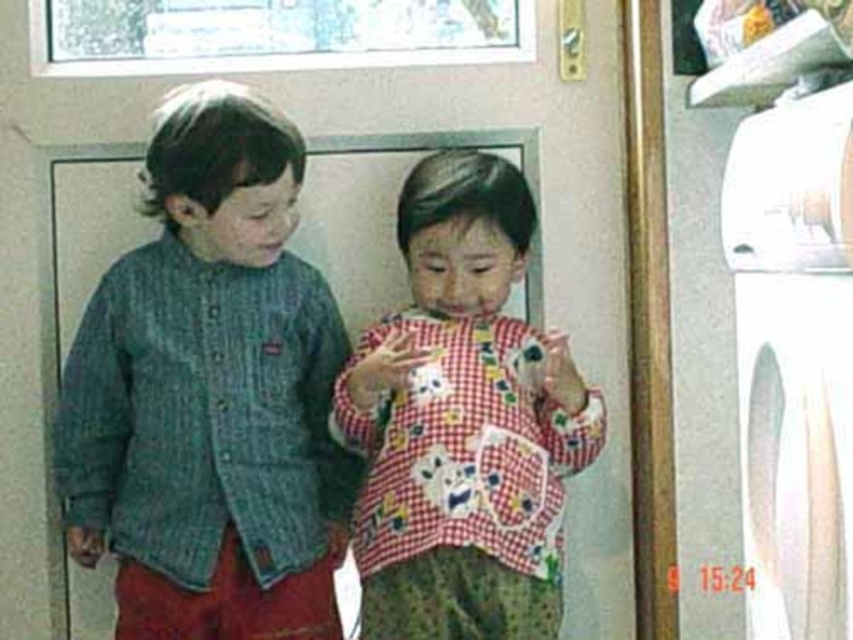
Question: Does red checkered shirt at center lie in front of white plastic washing machine at right?

Choices:
 (A) yes
 (B) no

Answer: (B)

Question: Which object appears closest to the camera in this image?

Choices:
 (A) white plastic washing machine at right
 (B) red checkered shirt at center
 (C) green textured sweater at left

Answer: (A)

Question: Which point is farther from the camera taking this photo?

Choices:
 (A) (750, 365)
 (B) (293, 272)

Answer: (B)

Question: Can you confirm if green textured sweater at left is positioned to the right of white plastic washing machine at right?

Choices:
 (A) yes
 (B) no

Answer: (B)

Question: Which object appears farthest from the camera in this image?

Choices:
 (A) red checkered shirt at center
 (B) green textured sweater at left

Answer: (A)

Question: Can you confirm if red checkered shirt at center is wider than white plastic washing machine at right?

Choices:
 (A) no
 (B) yes

Answer: (B)